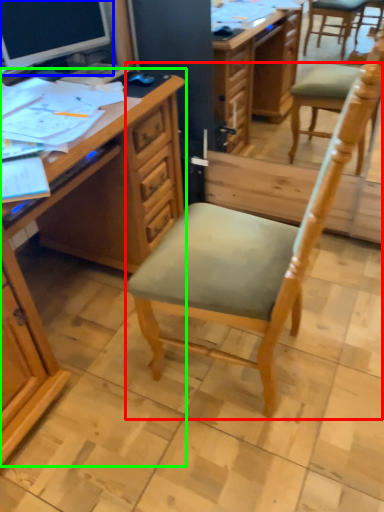
Question: Considering the real-world distances, which object is farthest from chair (highlighted by a red box)? computer monitor (highlighted by a blue box) or desk (highlighted by a green box)?

Choices:
 (A) computer monitor
 (B) desk

Answer: (A)